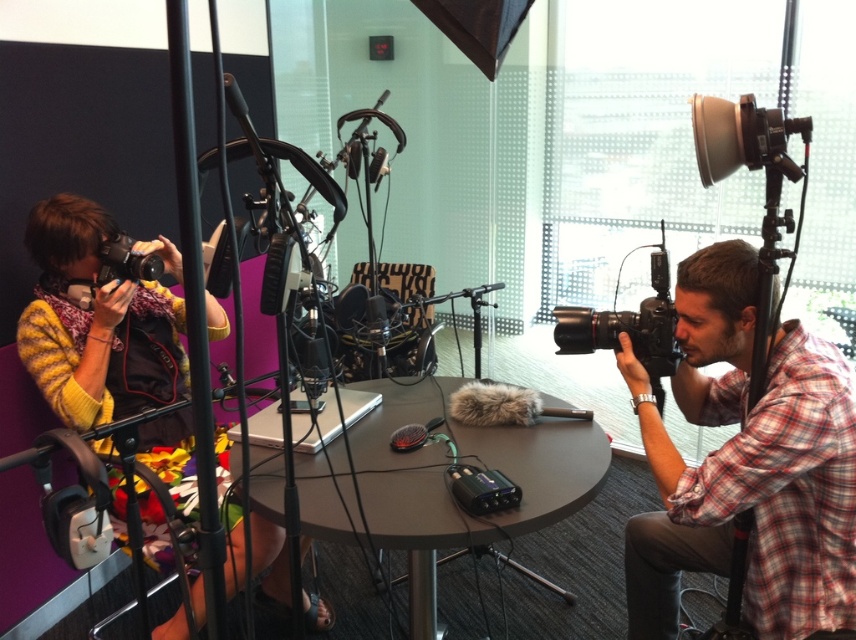
Which of these two, matte gray table at center or matte black camera at left, stands shorter?

Standing shorter between the two is matte black camera at left.

Is point (572, 445) in front of point (144, 268)?

Yes, it is.

The height and width of the screenshot is (640, 856). I want to click on matte gray table at center, so click(x=446, y=484).

Does plaid shirt at right have a lesser width compared to black plastic camera at right?

Incorrect, plaid shirt at right's width is not less than black plastic camera at right's.

Can you confirm if plaid shirt at right is taller than black plastic camera at right?

Indeed, plaid shirt at right has a greater height compared to black plastic camera at right.

Who is more forward, [723,419] or [604,333]?

Point [604,333] is in front.

Where is `plaid shirt at right`? Image resolution: width=856 pixels, height=640 pixels. plaid shirt at right is located at coordinates (746, 465).

Does black plastic camera at right have a lesser width compared to matte black camera at left?

No, black plastic camera at right is not thinner than matte black camera at left.

Does black plastic camera at right have a lesser height compared to matte black camera at left?

Incorrect, black plastic camera at right's height does not fall short of matte black camera at left's.

Find the location of a particular element. black plastic camera at right is located at coordinates (628, 324).